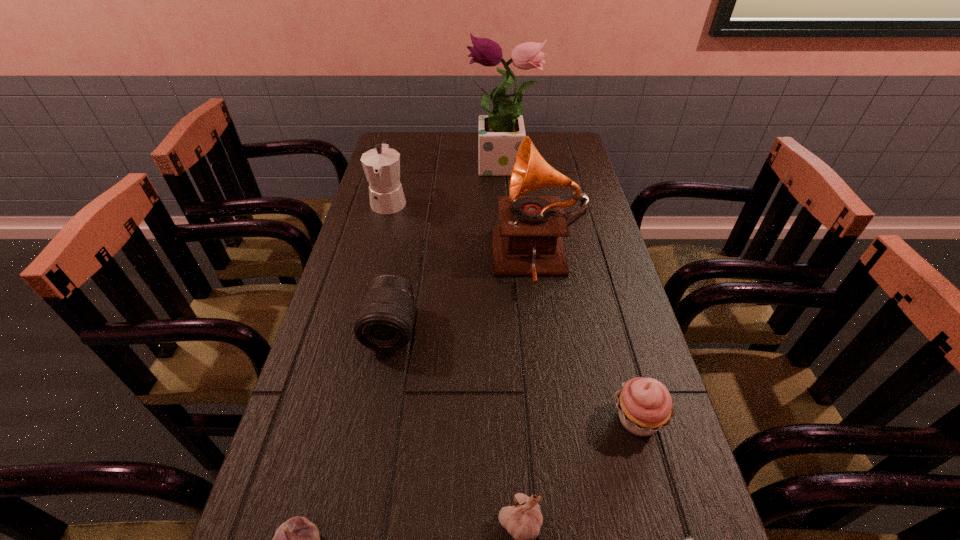
In the image, there is a desktop. What are the coordinates of `free space at the far edge` in the screenshot? It's located at (432, 135).

You are a GUI agent. You are given a task and a screenshot of the screen. Output one action in this format:
    pyautogui.click(x=<x>, y=<y>)
    Task: Click on the free space at the left edge
    This screenshot has height=540, width=960.
    Given the screenshot: What is the action you would take?
    pyautogui.click(x=325, y=490)

In order to click on vacant space at the right edge in this screenshot , I will do `click(605, 234)`.

This screenshot has width=960, height=540. In the image, there is a desktop. In order to click on vacant space at the far left corner in this screenshot , I will do `click(420, 132)`.

At what (x,y) coordinates should I click in order to perform the action: click on free space at the far right corner of the desktop. Please return your answer as a coordinate pair (x, y). This screenshot has height=540, width=960. Looking at the image, I should click on (567, 140).

Locate an element on the screen. Image resolution: width=960 pixels, height=540 pixels. free space between the cupcake and the fifth nearest object is located at coordinates (515, 374).

The width and height of the screenshot is (960, 540). What are the coordinates of `vacant area that lies between the flower arrangement and the coffeepot` in the screenshot? It's located at (446, 185).

Identify the location of free spot between the second tallest object and the fifth nearest object. (464, 295).

Identify which object is the seventh closest to the tallest object. Please provide its 2D coordinates. Your answer should be formatted as a tuple, i.e. [(x, y)], where the tuple contains the x and y coordinates of a point satisfying the conditions above.

[(297, 539)]

Identify which object is the second closest to the shortest garlic. Please provide its 2D coordinates. Your answer should be formatted as a tuple, i.e. [(x, y)], where the tuple contains the x and y coordinates of a point satisfying the conditions above.

[(523, 521)]